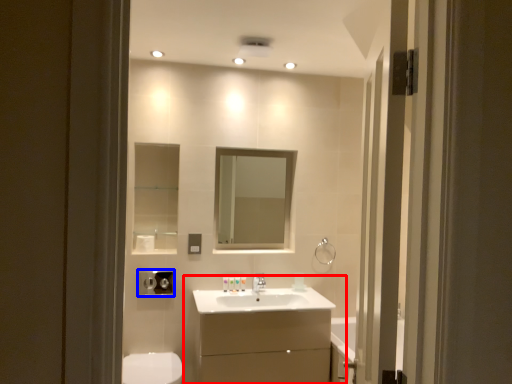
Question: Which point is closer to the camera, bathroom cabinet (highlighted by a red box) or hand dryer (highlighted by a blue box)?

Choices:
 (A) bathroom cabinet
 (B) hand dryer

Answer: (A)